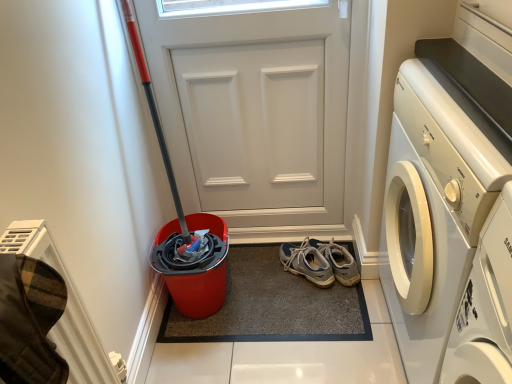
Question: Is white matte door at center with white glossy washing machine at right?

Choices:
 (A) no
 (B) yes

Answer: (A)

Question: Considering the relative positions of white matte door at center and white glossy washing machine at right in the image provided, is white matte door at center behind white glossy washing machine at right?

Choices:
 (A) no
 (B) yes

Answer: (B)

Question: From a real-world perspective, is white matte door at center on white glossy washing machine at right?

Choices:
 (A) yes
 (B) no

Answer: (A)

Question: From the image's perspective, does white matte door at center appear higher than white glossy washing machine at right?

Choices:
 (A) no
 (B) yes

Answer: (B)

Question: Is white matte door at center positioned in front of white glossy washing machine at right?

Choices:
 (A) no
 (B) yes

Answer: (A)

Question: From the image's perspective, is white matte door at center beneath white glossy washing machine at right?

Choices:
 (A) yes
 (B) no

Answer: (B)

Question: Is light blue suede sneakers at center with white glossy washing machine at right?

Choices:
 (A) no
 (B) yes

Answer: (A)

Question: Would you say white glossy washing machine at right is part of light blue suede sneakers at center's contents?

Choices:
 (A) no
 (B) yes

Answer: (A)

Question: Could you tell me if light blue suede sneakers at center is facing white glossy washing machine at right?

Choices:
 (A) no
 (B) yes

Answer: (B)

Question: From the image's perspective, is light blue suede sneakers at center under white glossy washing machine at right?

Choices:
 (A) yes
 (B) no

Answer: (A)

Question: Can you confirm if light blue suede sneakers at center is shorter than white glossy washing machine at right?

Choices:
 (A) yes
 (B) no

Answer: (A)

Question: Can you confirm if light blue suede sneakers at center is wider than white glossy washing machine at right?

Choices:
 (A) no
 (B) yes

Answer: (A)

Question: Considering the relative sizes of carpeted mat at center and white glossy washing machine at right in the image provided, is carpeted mat at center thinner than white glossy washing machine at right?

Choices:
 (A) no
 (B) yes

Answer: (A)